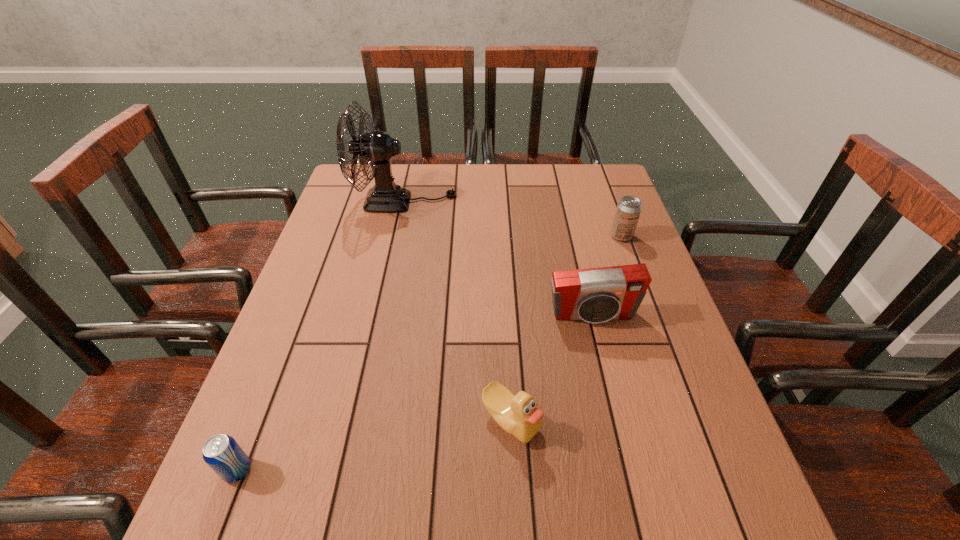
You are a GUI agent. You are given a task and a screenshot of the screen. Output one action in this format:
    pyautogui.click(x=<x>, y=<y>)
    Task: Click on the empty space that is in between the tallest object and the rightmost object
    This screenshot has width=960, height=540.
    Given the screenshot: What is the action you would take?
    pyautogui.click(x=513, y=219)

You are a GUI agent. You are given a task and a screenshot of the screen. Output one action in this format:
    pyautogui.click(x=<x>, y=<y>)
    Task: Click on the vacant area that lies between the fourth farthest object and the shorter beer can
    The height and width of the screenshot is (540, 960).
    Given the screenshot: What is the action you would take?
    pyautogui.click(x=374, y=445)

The width and height of the screenshot is (960, 540). In order to click on free space between the fourth object from right to left and the camera in this screenshot , I will do `click(498, 259)`.

Find the location of `empty location between the taller beer can and the fan`. empty location between the taller beer can and the fan is located at coordinates (513, 219).

Where is `free space between the second farthest object and the left beer can`? free space between the second farthest object and the left beer can is located at coordinates (429, 353).

The width and height of the screenshot is (960, 540). Identify the location of empty space that is in between the right beer can and the shorter beer can. (429, 353).

Find the location of a particular element. This screenshot has width=960, height=540. free space between the leftmost object and the tallest object is located at coordinates (321, 336).

Choose which object is the fourth nearest neighbor to the second object from left to right. Please provide its 2D coordinates. Your answer should be formatted as a tuple, i.e. [(x, y)], where the tuple contains the x and y coordinates of a point satisfying the conditions above.

[(222, 453)]

Select which object appears as the fourth closest to the second object from right to left. Please provide its 2D coordinates. Your answer should be formatted as a tuple, i.e. [(x, y)], where the tuple contains the x and y coordinates of a point satisfying the conditions above.

[(222, 453)]

At what (x,y) coordinates should I click in order to perform the action: click on vacant space that satisfies the following two spatial constraints: 1. in front of the second object from left to right, indicating the direction of air flow; 2. on the front side of the left beer can. Please return your answer as a coordinate pair (x, y). This screenshot has height=540, width=960. Looking at the image, I should click on (346, 470).